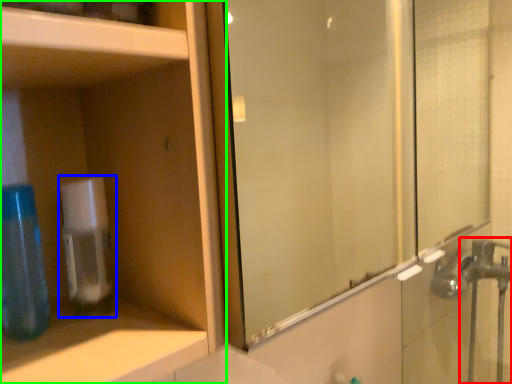
Question: Estimate the real-world distances between objects in this image. Which object is farther from faucet (highlighted by a red box), soap dispenser (highlighted by a blue box) or cabinetry (highlighted by a green box)?

Choices:
 (A) soap dispenser
 (B) cabinetry

Answer: (A)